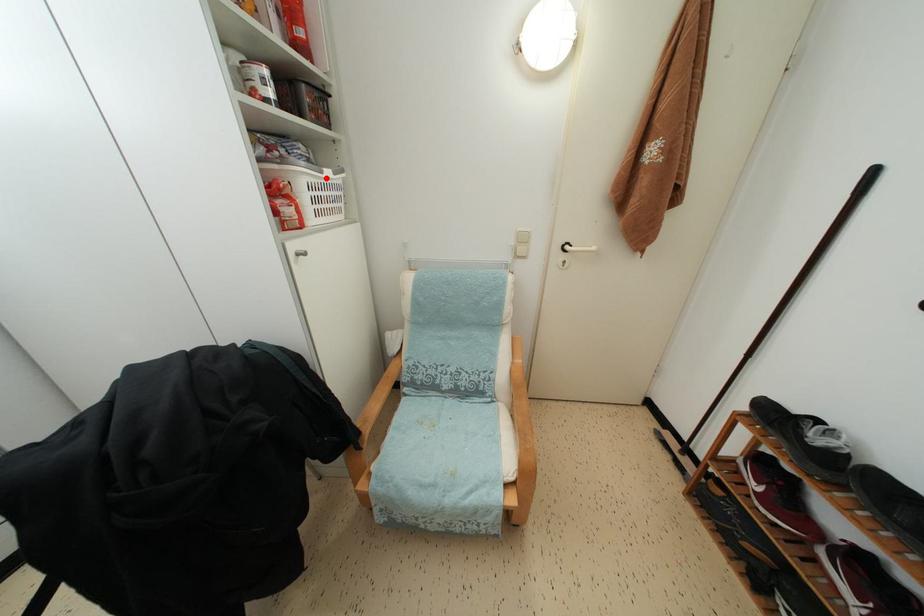
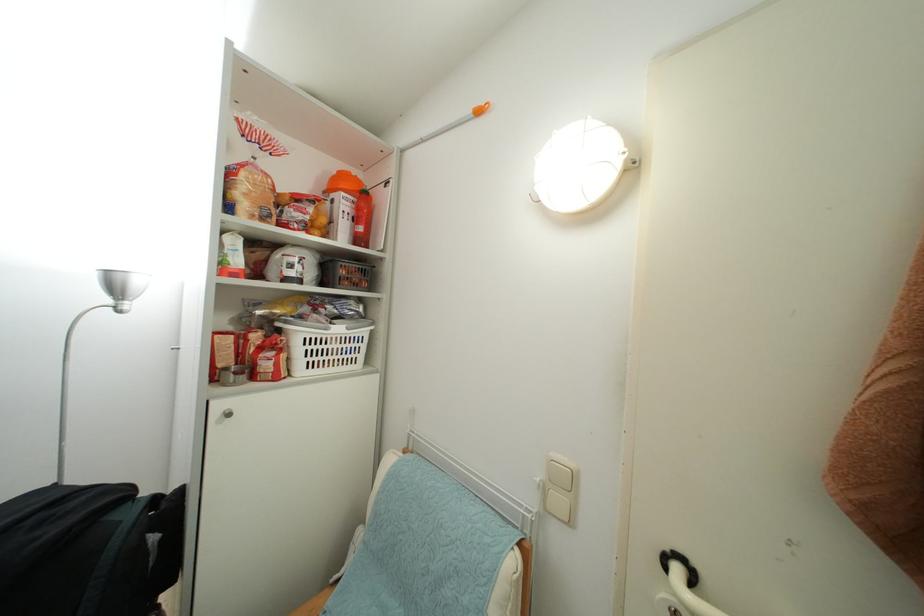
The point at the highlighted location is marked in the first image. Where is the corresponding point in the second image?

(331, 334)